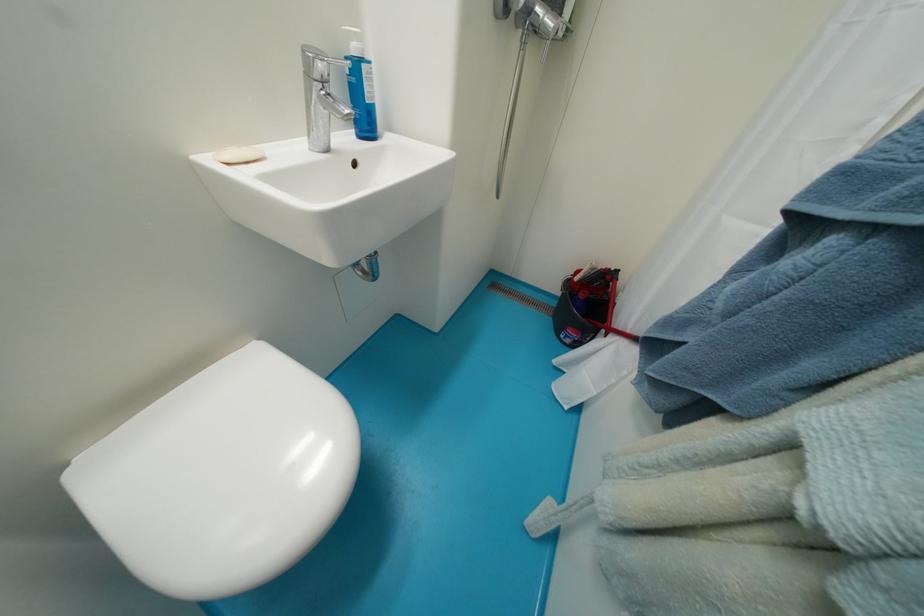
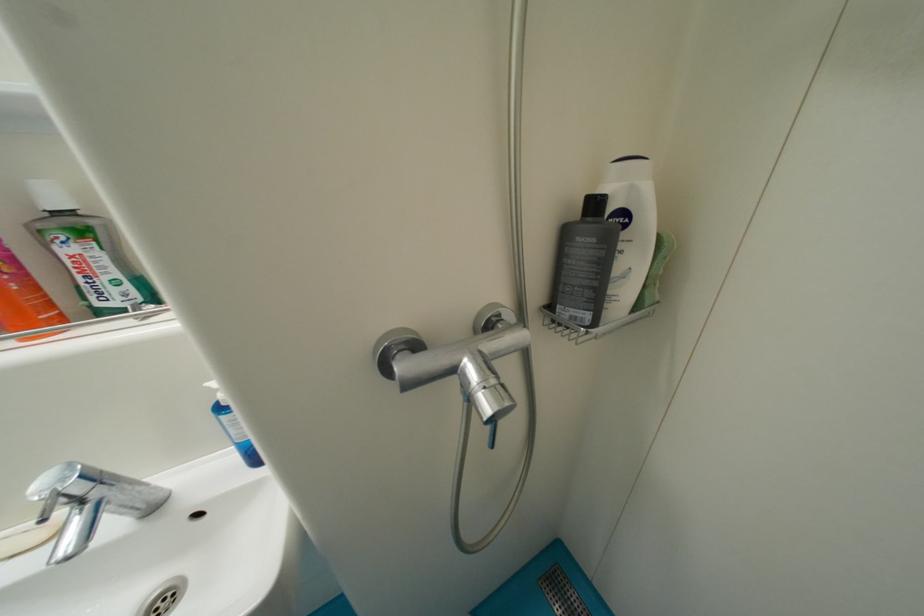
Based on the continuous images, in which direction is the camera rotating?

The camera's rotation is toward left-up.